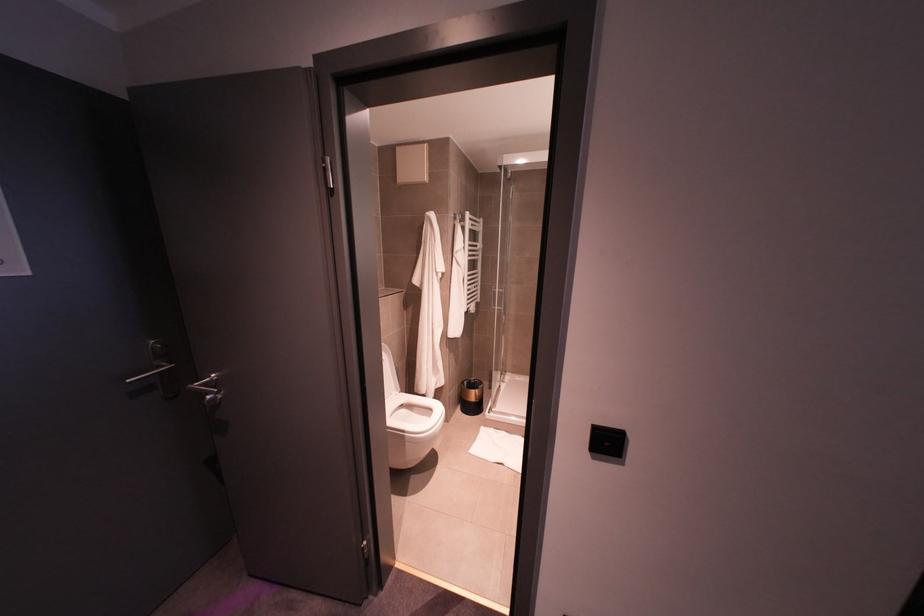
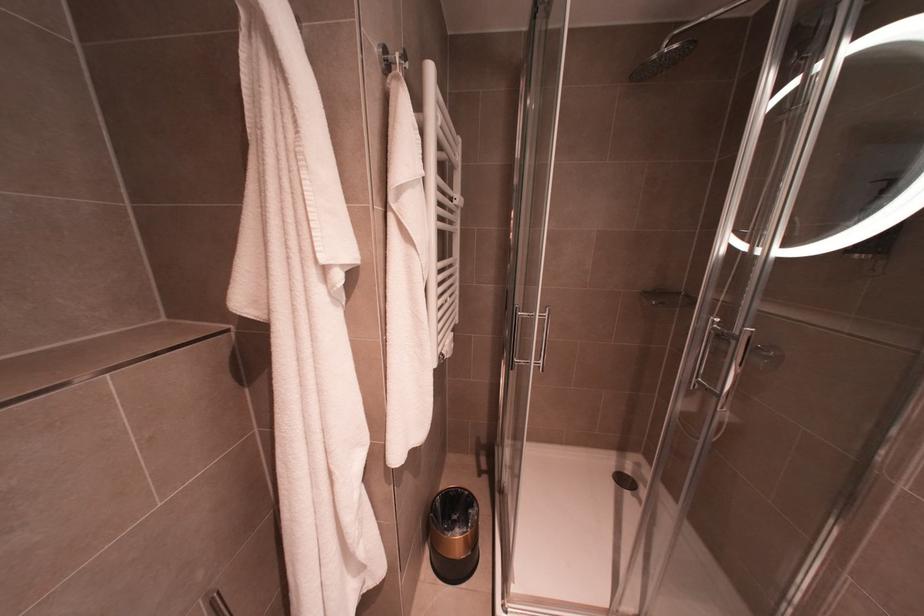
In the second image, find the point that corresponds to point 455,217 in the first image.

(386, 66)